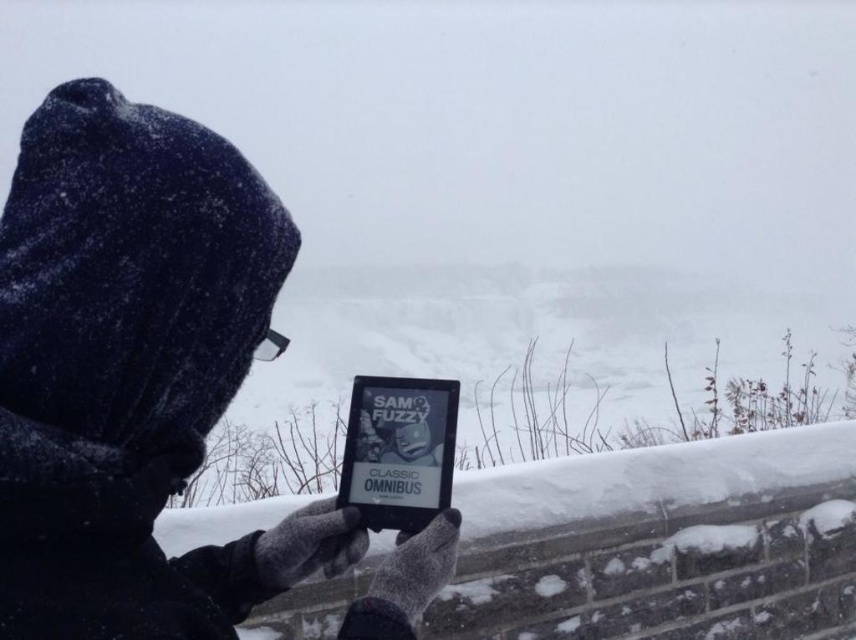
Is the position of black fabric hood at upper left less distant than that of black matte tablet at center?

Yes, it is in front of black matte tablet at center.

Does point (197, 232) come in front of point (409, 532)?

Yes, it is.

Describe the element at coordinates (134, 372) in the screenshot. This screenshot has width=856, height=640. I see `black fabric hood at upper left` at that location.

Locate an element on the screen. This screenshot has width=856, height=640. black fabric hood at upper left is located at coordinates (134, 372).